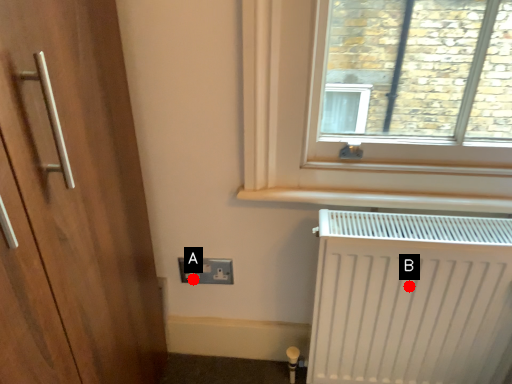
Question: Two points are circled on the image, labeled by A and B beside each circle. Which point is closer to the camera taking this photo?

Choices:
 (A) A is closer
 (B) B is closer

Answer: (B)